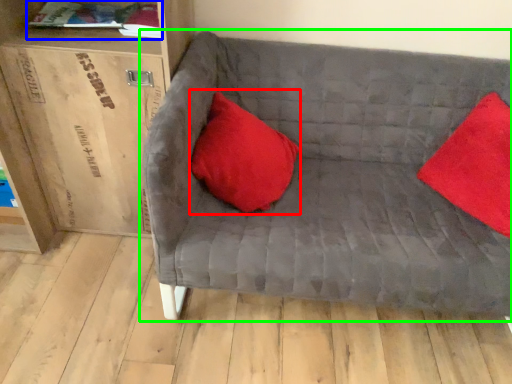
Question: Based on their relative distances, which object is nearer to pillow (highlighted by a red box)? Choose from book (highlighted by a blue box) and studio couch (highlighted by a green box).

Choices:
 (A) book
 (B) studio couch

Answer: (B)